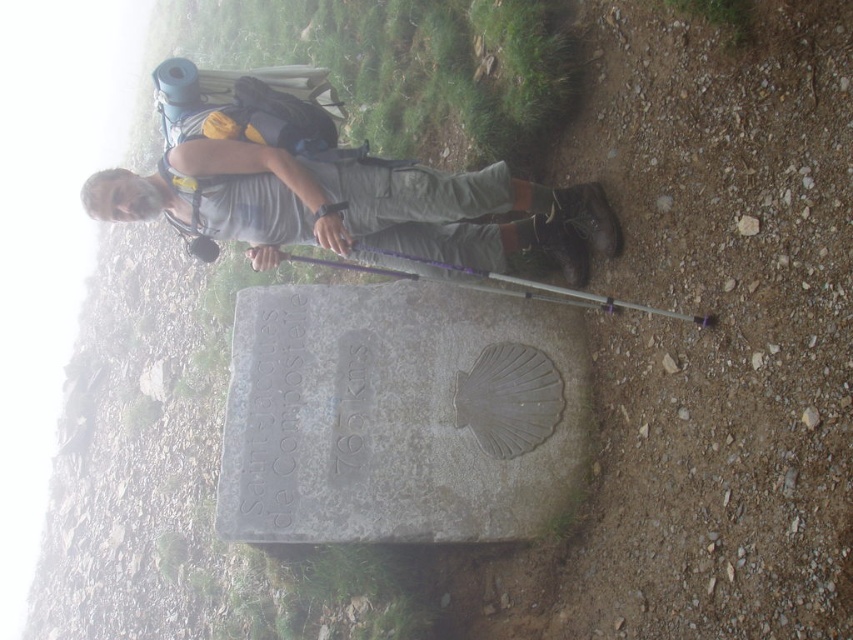
Question: Can you confirm if gray stone marker at center is positioned above gray fabric backpack at upper center?

Choices:
 (A) yes
 (B) no

Answer: (B)

Question: Which point is farther to the camera?

Choices:
 (A) (447, 266)
 (B) (454, 189)

Answer: (A)

Question: Among these objects, which one is farthest from the camera?

Choices:
 (A) gray fabric backpack at upper center
 (B) purple plastic ski pole at center

Answer: (A)

Question: Which object appears farthest from the camera in this image?

Choices:
 (A) gray fabric backpack at upper center
 (B) gray stone marker at center
 (C) purple plastic ski pole at center

Answer: (B)

Question: Is gray stone marker at center to the right of gray fabric backpack at upper center from the viewer's perspective?

Choices:
 (A) yes
 (B) no

Answer: (A)

Question: Is gray stone marker at center bigger than gray fabric backpack at upper center?

Choices:
 (A) no
 (B) yes

Answer: (B)